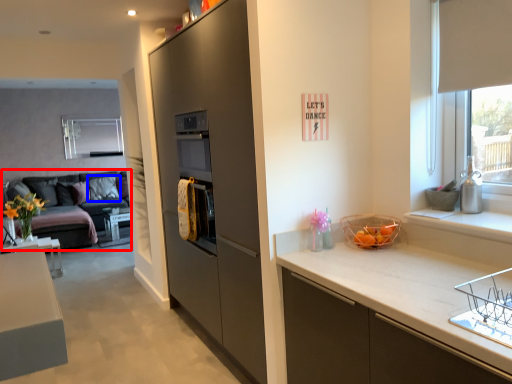
Question: Which object appears farthest to the camera in this image, studio couch (highlighted by a red box) or pillow (highlighted by a blue box)?

Choices:
 (A) studio couch
 (B) pillow

Answer: (B)